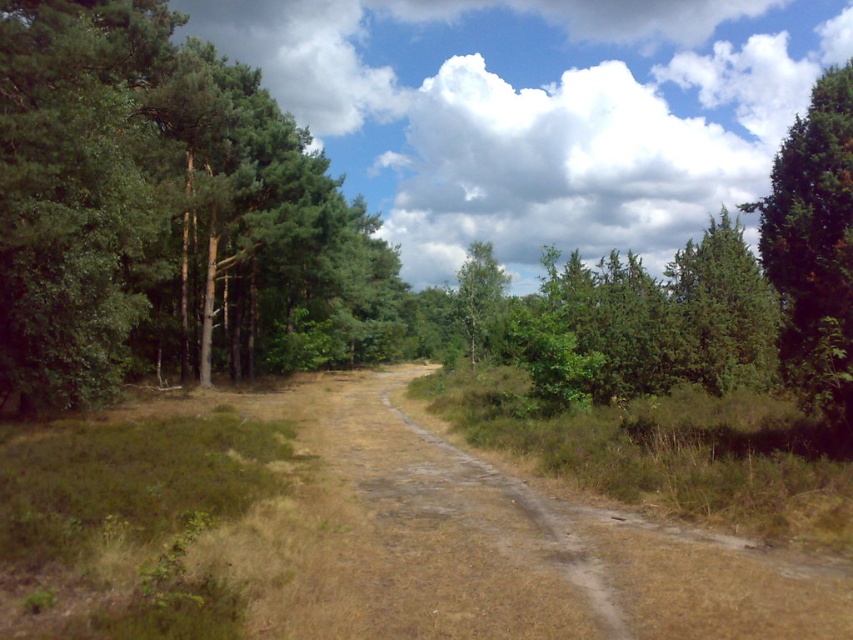
Question: Estimate the real-world distances between objects in this image. Which object is farther from the green leafy trees at left?

Choices:
 (A) green textured tree at right
 (B) green leafy tree at center

Answer: (A)

Question: Is green leafy trees at left wider than green leafy tree at center?

Choices:
 (A) yes
 (B) no

Answer: (A)

Question: Which object is the farthest from the green leafy trees at left?

Choices:
 (A) green leafy tree at center
 (B) green textured tree at right

Answer: (B)

Question: Can you confirm if green textured tree at right is wider than green leafy tree at center?

Choices:
 (A) no
 (B) yes

Answer: (B)

Question: Does green textured tree at right appear under green leafy tree at center?

Choices:
 (A) yes
 (B) no

Answer: (B)

Question: Which object is closer to the camera taking this photo?

Choices:
 (A) green leafy tree at center
 (B) green leafy trees at left
 (C) green textured tree at right

Answer: (B)